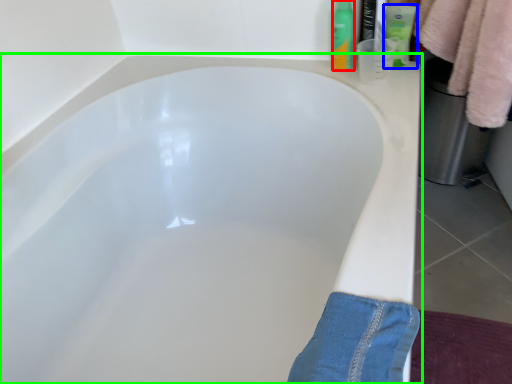
Question: Based on their relative distances, which object is farther from toiletry (highlighted by a red box)? Choose from toiletry (highlighted by a blue box) and bathtub (highlighted by a green box).

Choices:
 (A) toiletry
 (B) bathtub

Answer: (B)